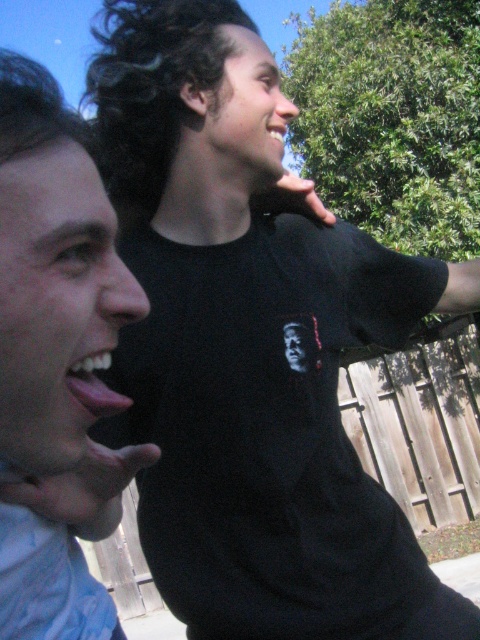
Question: Which is nearer to the matte black hand at lower left?

Choices:
 (A) blue fabric mouth at left
 (B) black matte wristband at upper right

Answer: (A)

Question: Which object is positioned closest to the blue fabric mouth at left?

Choices:
 (A) black matte phone at upper center
 (B) matte black hand at lower left

Answer: (B)

Question: Where is blue fabric mouth at left located in relation to matte black hand at lower left in the image?

Choices:
 (A) above
 (B) below

Answer: (A)

Question: Which of the following is the closest to the observer?

Choices:
 (A) blue fabric mouth at left
 (B) matte black hand at lower left

Answer: (A)

Question: Can you confirm if blue fabric mouth at left is bigger than matte black hand at lower left?

Choices:
 (A) no
 (B) yes

Answer: (B)

Question: Can you confirm if blue fabric mouth at left is positioned above matte black hand at lower left?

Choices:
 (A) yes
 (B) no

Answer: (A)